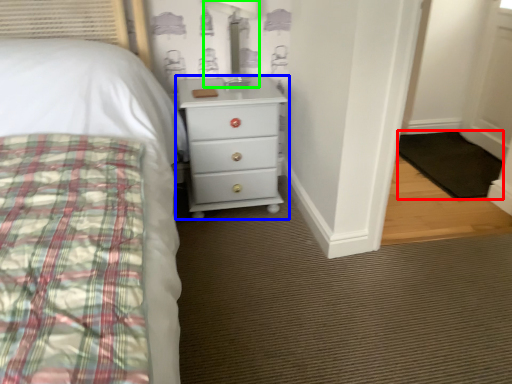
Question: Estimate the real-world distances between objects in this image. Which object is closer to mat (highlighted by a red box), chest of drawers (highlighted by a blue box) or table lamp (highlighted by a green box)?

Choices:
 (A) chest of drawers
 (B) table lamp

Answer: (A)